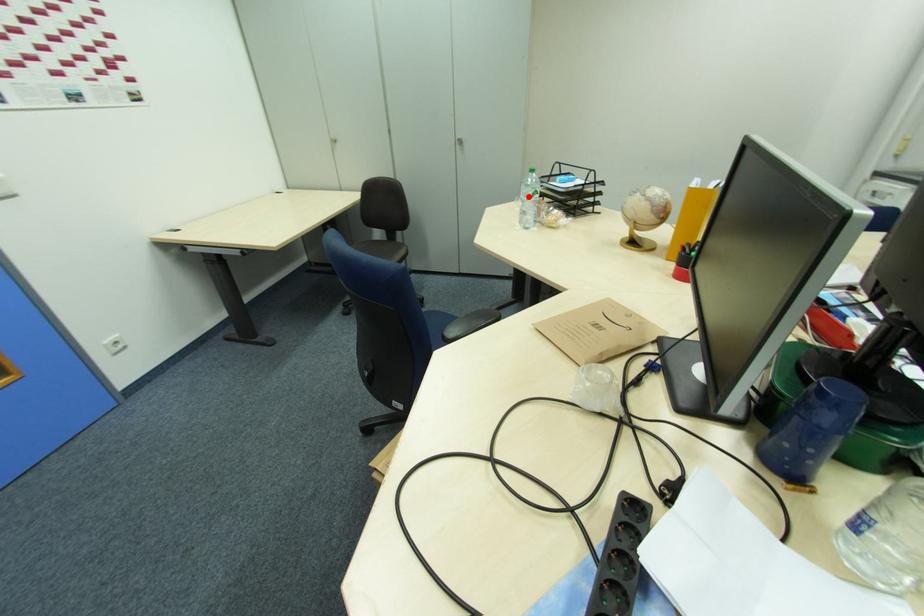
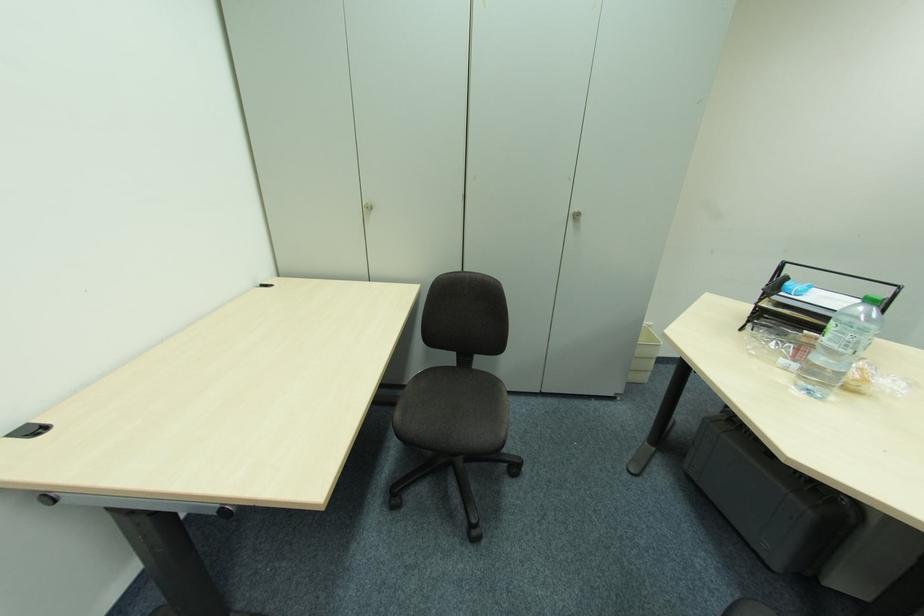
Find the pixel in the second image that matches the highlighted location in the first image.

(850, 347)